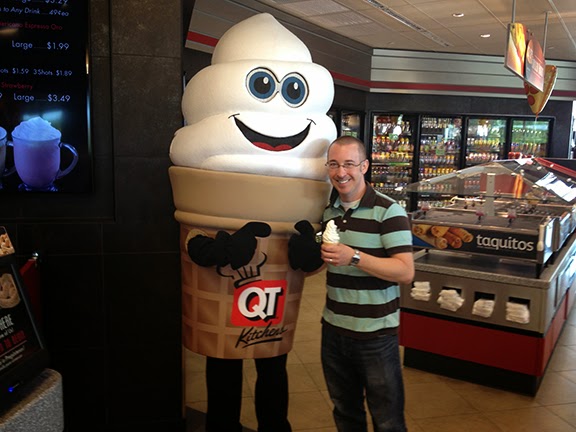
Find the location of `napkins`. napkins is located at coordinates click(x=480, y=304).